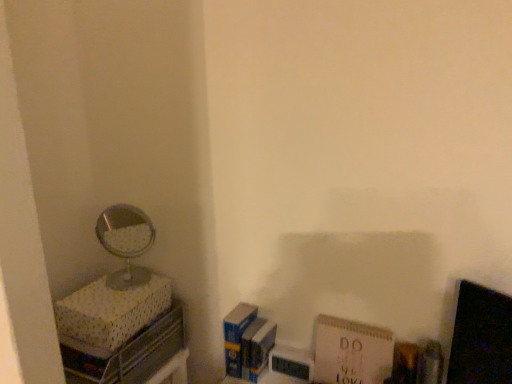
Question: From a real-world perspective, is shiny silver mirror at left physically located above or below white paper at lower right, marked as the second paperback book in a left-to-right arrangement?

Choices:
 (A) below
 (B) above

Answer: (B)

Question: Is point (137, 210) positioned closer to the camera than point (320, 317)?

Choices:
 (A) farther
 (B) closer

Answer: (A)

Question: Which of these objects is positioned closest to the blue matte paperback book at lower center, arranged as the 2th paperback book when viewed from the right?

Choices:
 (A) shiny silver mirror at left
 (B) white paper at lower right, marked as the second paperback book in a left-to-right arrangement

Answer: (B)

Question: Which of these objects is positioned farthest from the blue matte paperback book at lower center, arranged as the 2th paperback book when viewed from the right?

Choices:
 (A) shiny silver mirror at left
 (B) white paper at lower right, which is the first paperback book in right-to-left order

Answer: (A)